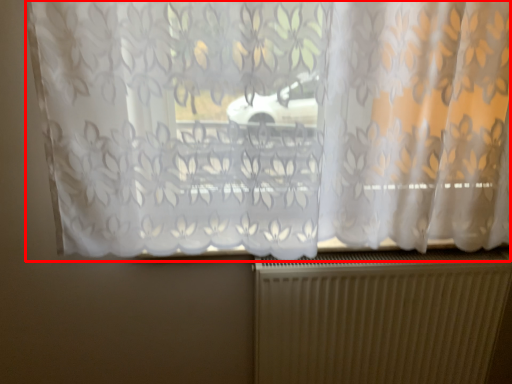
Question: From the image, what is the correct spatial relationship of curtain (annotated by the red box) in relation to radiator?

Choices:
 (A) left
 (B) right

Answer: (A)